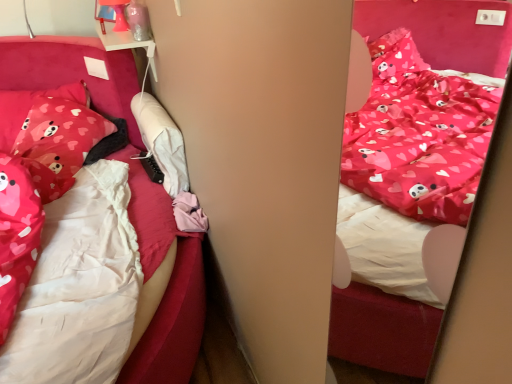
Question: Is matte pink fabric bed at center bigger than matte pink pillow with heart patterns at left, which is the 2th pillow from left to right?

Choices:
 (A) yes
 (B) no

Answer: (B)

Question: Could matte pink pillow with heart patterns at left, which is the 2th pillow from left to right, be considered to be inside matte pink fabric bed at center?

Choices:
 (A) no
 (B) yes

Answer: (A)

Question: From a real-world perspective, is matte pink fabric bed at center below matte pink pillow with heart patterns at left, arranged as the first pillow when viewed from the right?

Choices:
 (A) yes
 (B) no

Answer: (B)

Question: Is matte pink fabric bed at center thinner than matte pink pillow with heart patterns at left, arranged as the first pillow when viewed from the right?

Choices:
 (A) yes
 (B) no

Answer: (A)

Question: From a real-world perspective, is matte pink fabric bed at center over matte pink pillow with heart patterns at left, which is the 2th pillow from left to right?

Choices:
 (A) no
 (B) yes

Answer: (B)

Question: Does matte pink fabric bed at center have a lesser height compared to matte pink pillow with heart patterns at left, which is the 2th pillow from left to right?

Choices:
 (A) yes
 (B) no

Answer: (B)

Question: Is matte pink pillow with heart patterns at left, the 2th pillow viewed from the right, placed right next to matte pink pillow with heart patterns at left, arranged as the first pillow when viewed from the right?

Choices:
 (A) yes
 (B) no

Answer: (B)

Question: Does matte pink pillow with heart patterns at left, the 1th pillow positioned from the left, have a smaller size compared to matte pink pillow with heart patterns at left, which is the 2th pillow from left to right?

Choices:
 (A) yes
 (B) no

Answer: (B)

Question: From a real-world perspective, is matte pink pillow with heart patterns at left, the 2th pillow viewed from the right, below matte pink pillow with heart patterns at left, arranged as the first pillow when viewed from the right?

Choices:
 (A) no
 (B) yes

Answer: (A)

Question: From the image's perspective, is matte pink pillow with heart patterns at left, the 1th pillow positioned from the left, below matte pink pillow with heart patterns at left, arranged as the first pillow when viewed from the right?

Choices:
 (A) no
 (B) yes

Answer: (A)

Question: Can you confirm if matte pink pillow with heart patterns at left, the 1th pillow positioned from the left, is positioned to the left of matte pink pillow with heart patterns at left, arranged as the first pillow when viewed from the right?

Choices:
 (A) no
 (B) yes

Answer: (B)

Question: From a real-world perspective, is matte pink pillow with heart patterns at left, the 2th pillow viewed from the right, over matte pink pillow with heart patterns at left, arranged as the first pillow when viewed from the right?

Choices:
 (A) yes
 (B) no

Answer: (A)

Question: Does matte pink pillow with heart patterns at left, which is the 2th pillow from left to right, have a greater height compared to matte pink pillow with heart patterns at left, the 1th pillow positioned from the left?

Choices:
 (A) no
 (B) yes

Answer: (A)